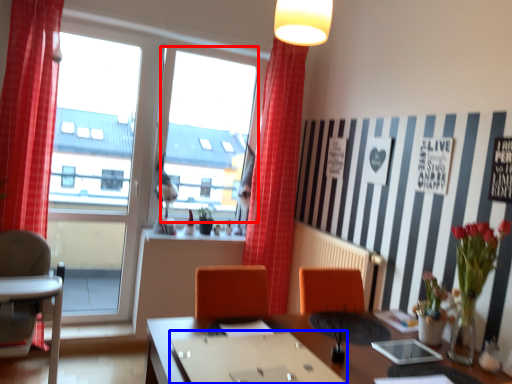
Question: Which object is closer to the camera taking this photo, window screen (highlighted by a red box) or round table (highlighted by a blue box)?

Choices:
 (A) window screen
 (B) round table

Answer: (B)